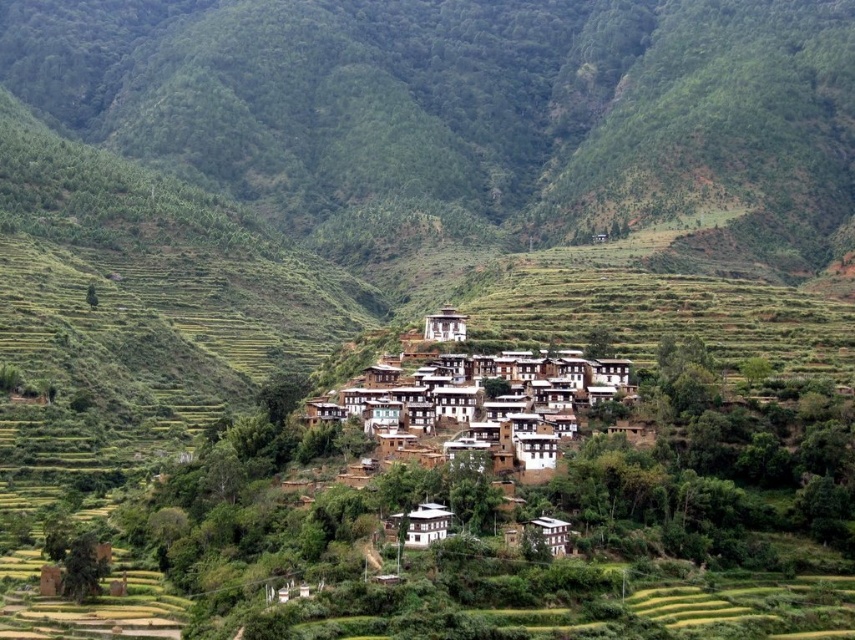
Between green grassy hillside at center and white stucco village at center, which one appears on the left side from the viewer's perspective?

From the viewer's perspective, green grassy hillside at center appears more on the left side.

Between green grassy hillside at center and white stucco village at center, which one is positioned lower?

white stucco village at center is lower down.

Does point (815, 35) come closer to viewer compared to point (608, 371)?

No, (815, 35) is behind (608, 371).

At what (x,y) coordinates should I click in order to perform the action: click on green grassy hillside at center. Please return your answer as a coordinate pair (x, y). This screenshot has height=640, width=855. Looking at the image, I should click on (472, 113).